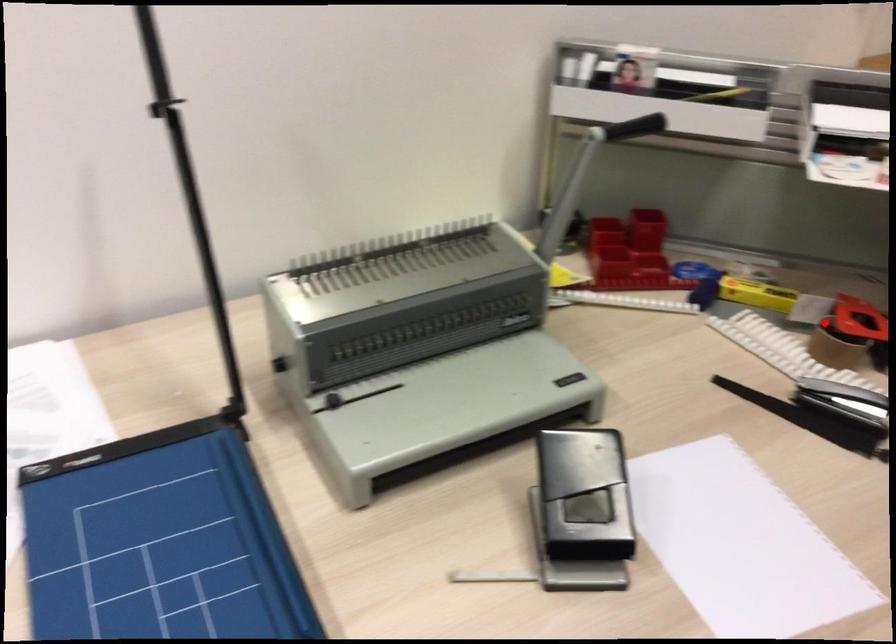
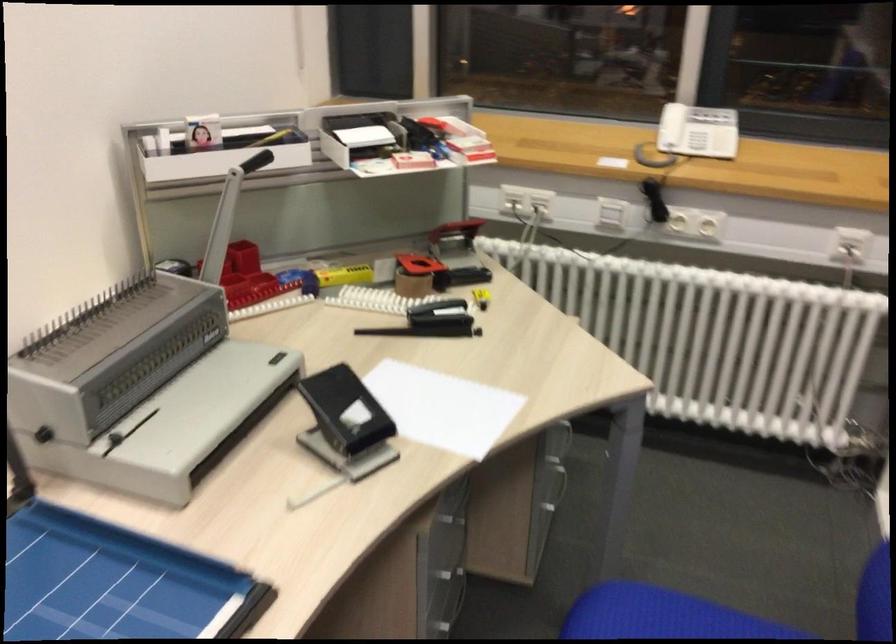
Question: I am providing you with two images of the same scene from different viewpoints. Image1 has a red point marked. In image2, the corresponding 3D location appears at what relative position? Reply with the corresponding letter.

Choices:
 (A) Closer
 (B) Farther

Answer: (B)